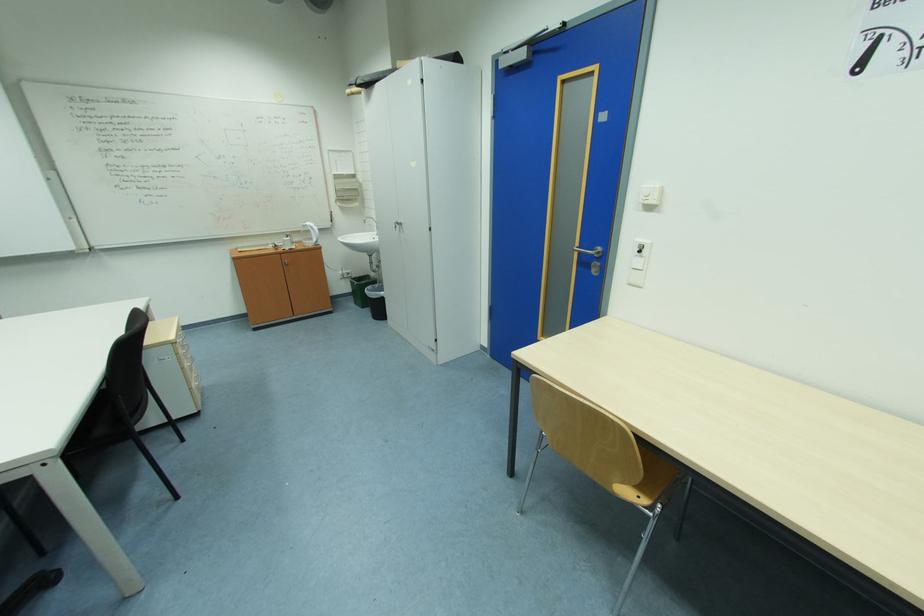
At what (x,y) coordinates should I click in order to perform the action: click on wooden chair sitting surface. Please return your answer as a coordinate pair (x, y). The height and width of the screenshot is (616, 924). Looking at the image, I should click on tap(652, 475).